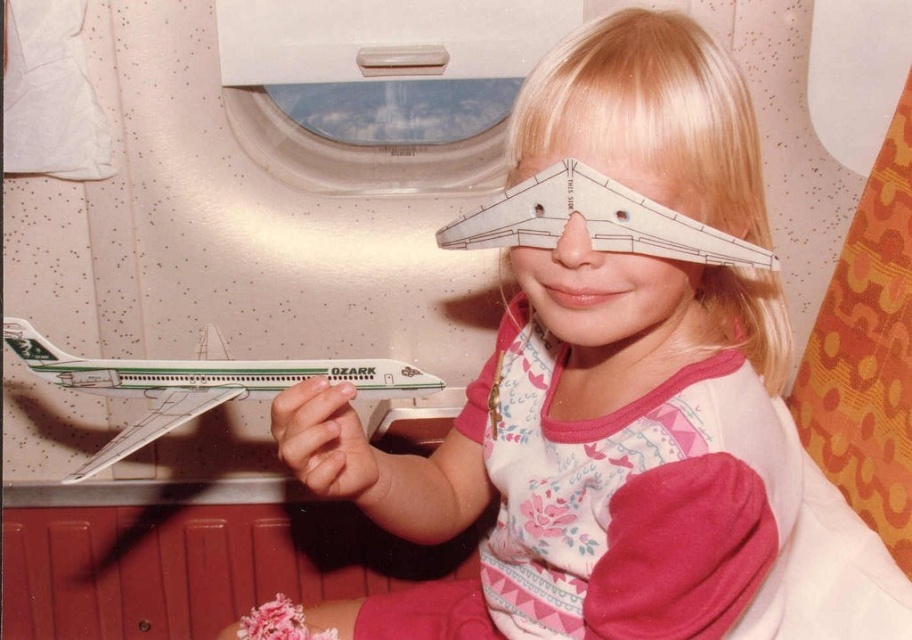
Based on the photo, does pink fabric shirt at center have a smaller size compared to green and white paper airplane at left?

Incorrect, pink fabric shirt at center is not smaller in size than green and white paper airplane at left.

Which of these two, pink fabric shirt at center or green and white paper airplane at left, stands shorter?

Standing shorter between the two is green and white paper airplane at left.

Where is `pink fabric shirt at center`? pink fabric shirt at center is located at coordinates (613, 392).

Which of these two, pink fabric shirt at center or transparent plastic airplane window at upper center, stands shorter?

With less height is transparent plastic airplane window at upper center.

Does pink fabric shirt at center have a greater width compared to transparent plastic airplane window at upper center?

Yes.

Who is more distant from viewer, (644, 444) or (436, 35)?

Positioned behind is point (436, 35).

This screenshot has height=640, width=912. Identify the location of pink fabric shirt at center. (613, 392).

The width and height of the screenshot is (912, 640). What do you see at coordinates (375, 80) in the screenshot?
I see `transparent plastic airplane window at upper center` at bounding box center [375, 80].

Between transparent plastic airplane window at upper center and green and white paper airplane at left, which one is positioned higher?

Positioned higher is transparent plastic airplane window at upper center.

Between point (535, 29) and point (61, 481), which one is positioned in front?

Point (61, 481) is more forward.

Where is `transparent plastic airplane window at upper center`? This screenshot has width=912, height=640. transparent plastic airplane window at upper center is located at coordinates (375, 80).